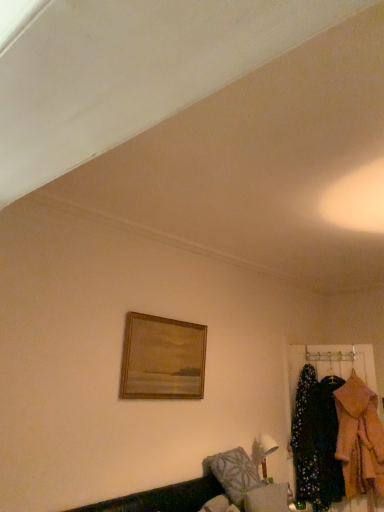
Question: Is wooden framed painting at upper center shorter than velvet green couch at lower right?

Choices:
 (A) no
 (B) yes

Answer: (A)

Question: Is wooden framed painting at upper center next to velvet green couch at lower right?

Choices:
 (A) no
 (B) yes

Answer: (A)

Question: Is wooden framed painting at upper center thinner than velvet green couch at lower right?

Choices:
 (A) no
 (B) yes

Answer: (B)

Question: Is wooden framed painting at upper center oriented away from velvet green couch at lower right?

Choices:
 (A) yes
 (B) no

Answer: (B)

Question: Is wooden framed painting at upper center outside velvet green couch at lower right?

Choices:
 (A) yes
 (B) no

Answer: (A)

Question: Does point (157, 396) appear closer or farther from the camera than point (185, 501)?

Choices:
 (A) farther
 (B) closer

Answer: (A)

Question: From a real-world perspective, is wooden framed painting at upper center positioned above or below velvet green couch at lower right?

Choices:
 (A) above
 (B) below

Answer: (A)

Question: In terms of size, does wooden framed painting at upper center appear bigger or smaller than velvet green couch at lower right?

Choices:
 (A) small
 (B) big

Answer: (A)

Question: Would you say wooden framed painting at upper center is inside or outside velvet green couch at lower right?

Choices:
 (A) inside
 (B) outside

Answer: (B)

Question: Does point (354, 425) appear closer or farther from the camera than point (178, 493)?

Choices:
 (A) closer
 (B) farther

Answer: (B)

Question: Do you think fluffy pink coat at right is within velvet green couch at lower right, or outside of it?

Choices:
 (A) inside
 (B) outside

Answer: (B)

Question: In terms of size, does fluffy pink coat at right appear bigger or smaller than velvet green couch at lower right?

Choices:
 (A) small
 (B) big

Answer: (A)

Question: Looking at their shapes, would you say fluffy pink coat at right is wider or thinner than velvet green couch at lower right?

Choices:
 (A) thin
 (B) wide

Answer: (A)

Question: Is floral fabric coat at right taller or shorter than fluffy gray pillow at lower center?

Choices:
 (A) tall
 (B) short

Answer: (A)

Question: From the image's perspective, relative to fluffy gray pillow at lower center, is floral fabric coat at right above or below?

Choices:
 (A) below
 (B) above

Answer: (B)